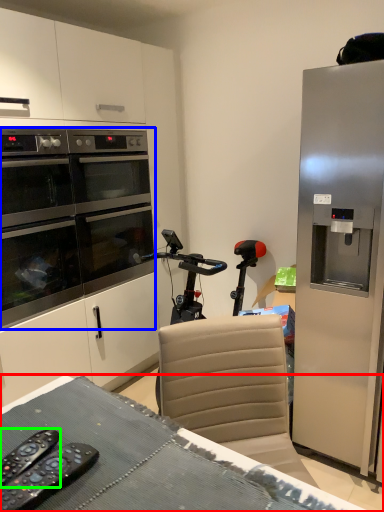
Question: Which is farther away from desk (highlighted by a red box)? home appliance (highlighted by a blue box) or remote control (highlighted by a green box)?

Choices:
 (A) home appliance
 (B) remote control

Answer: (A)